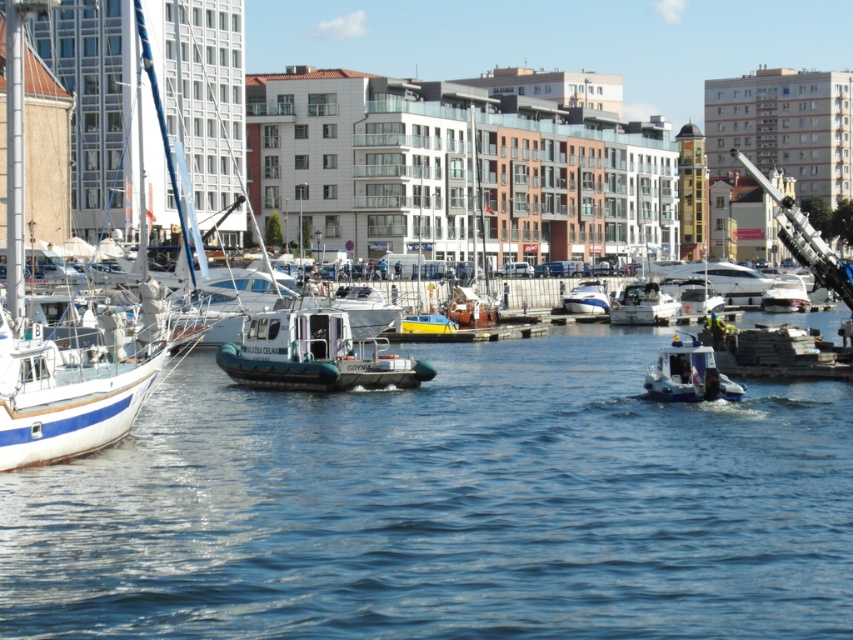
Is blue water at center taller than white glossy boat at center?

No.

Can you confirm if blue water at center is bigger than white glossy boat at center?

Yes, blue water at center is bigger than white glossy boat at center.

The height and width of the screenshot is (640, 853). Find the location of `blue water at center`. blue water at center is located at coordinates (445, 508).

Which is below, white plastic boat at center or white glossy speedboat at center?

Positioned lower is white plastic boat at center.

Does white plastic boat at center have a lesser width compared to white glossy speedboat at center?

Indeed, white plastic boat at center has a lesser width compared to white glossy speedboat at center.

The height and width of the screenshot is (640, 853). Find the location of `white plastic boat at center`. white plastic boat at center is located at coordinates (688, 374).

Is point (267, 333) closer to viewer compared to point (637, 320)?

Yes, it is.

Does point (346, 342) come in front of point (636, 314)?

Yes, point (346, 342) is closer to viewer.

Locate an element on the screen. green rubber boat at center is located at coordinates (312, 353).